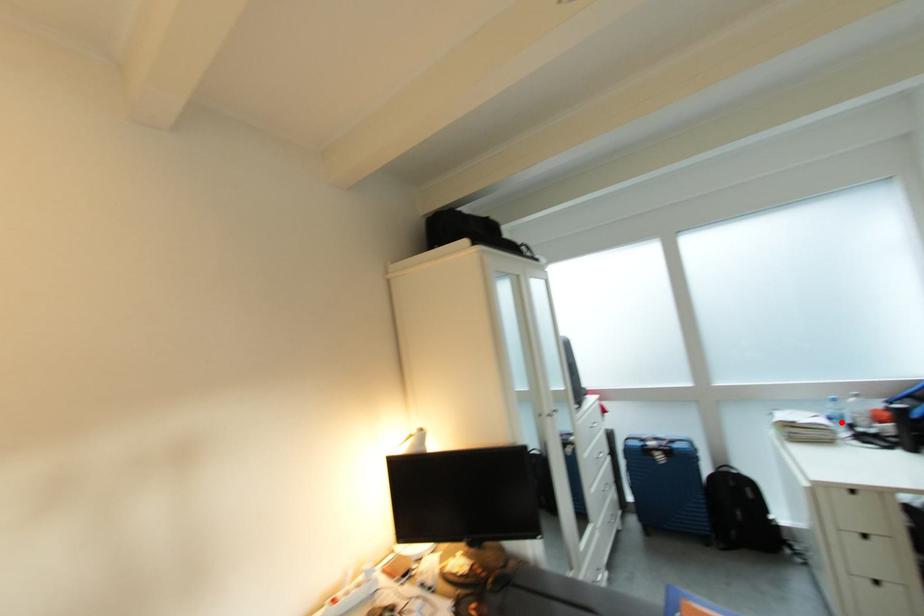
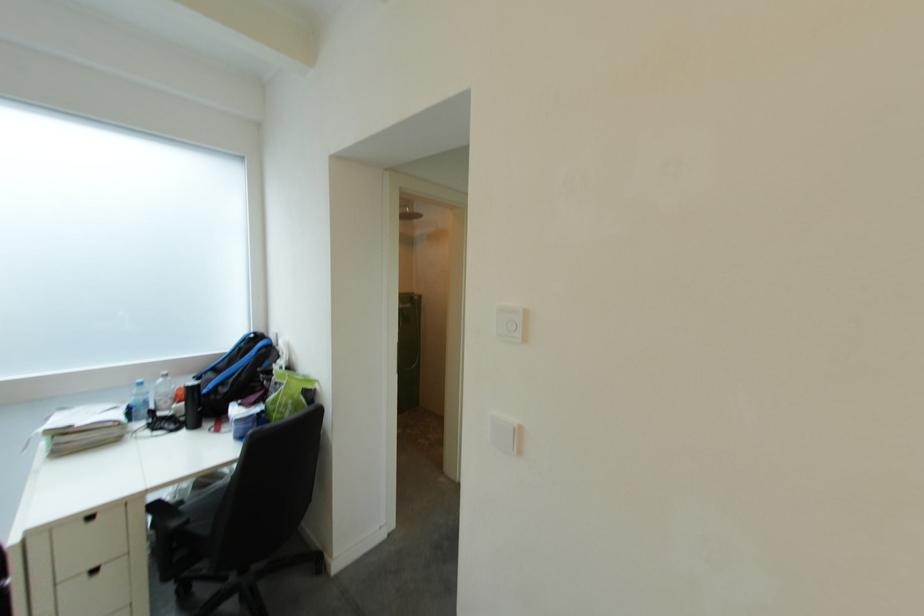
Find the pixel in the second image that matches the highlighted location in the first image.

(141, 411)